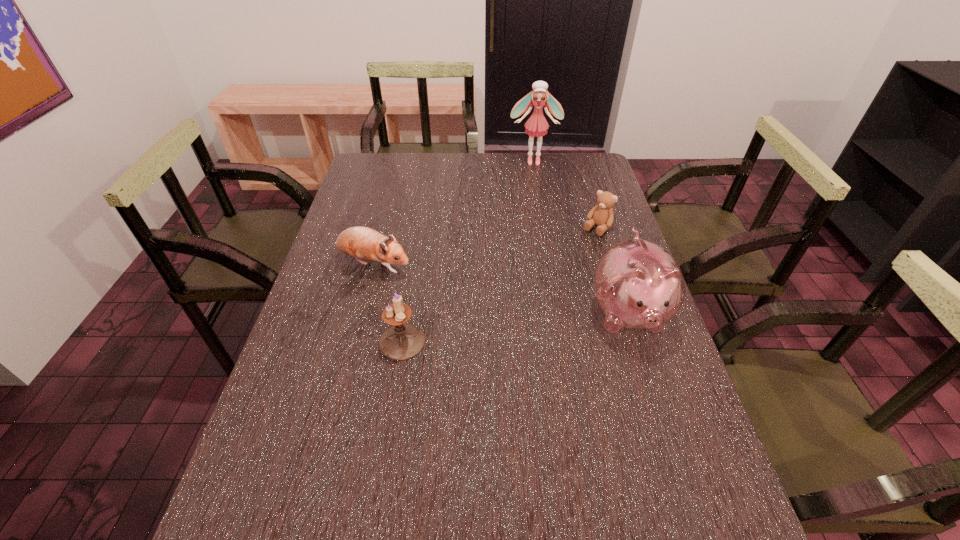
Image resolution: width=960 pixels, height=540 pixels. Find the location of `teddy bear that is at the right edge`. teddy bear that is at the right edge is located at coordinates (602, 215).

Locate an element on the screen. doll that is at the right edge is located at coordinates (536, 125).

Locate an element on the screen. The image size is (960, 540). object positioned at the far right corner is located at coordinates [x=536, y=125].

Image resolution: width=960 pixels, height=540 pixels. Identify the location of vacant region at the far edge of the desktop. (455, 168).

At what (x,y) coordinates should I click in order to perform the action: click on vacant space at the left edge of the desktop. Please return your answer as a coordinate pair (x, y). This screenshot has width=960, height=540. Looking at the image, I should click on (349, 338).

You are a GUI agent. You are given a task and a screenshot of the screen. Output one action in this format:
    pyautogui.click(x=<x>, y=<y>)
    Task: Click on the free space at the right edge of the desktop
    The width and height of the screenshot is (960, 540).
    Given the screenshot: What is the action you would take?
    point(595,192)

You are a GUI agent. You are given a task and a screenshot of the screen. Output one action in this format:
    pyautogui.click(x=<x>, y=<y>)
    Task: Click on the vacant space at the far left corner of the desktop
    The image size is (960, 540).
    Given the screenshot: What is the action you would take?
    pyautogui.click(x=365, y=175)

The image size is (960, 540). In the image, there is a desktop. What are the coordinates of `vacant area at the near left corner` in the screenshot? It's located at (318, 462).

What are the coordinates of `unoccupied area between the farthest object and the hamster` in the screenshot? It's located at (453, 213).

The width and height of the screenshot is (960, 540). In order to click on empty space that is in between the hamster and the doll in this screenshot , I will do `click(453, 213)`.